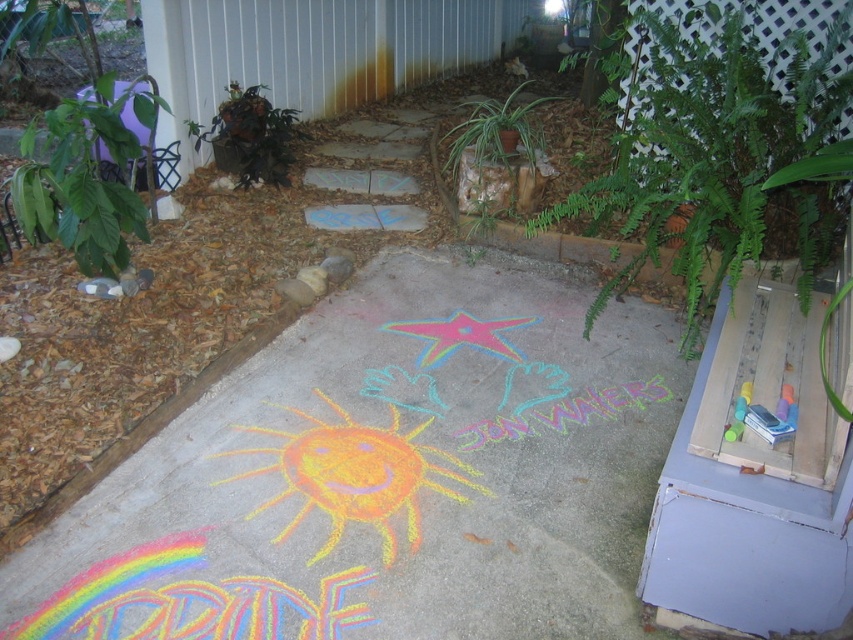
Question: Does chalk drawing at center appear over green leafy plant at upper left?

Choices:
 (A) no
 (B) yes

Answer: (A)

Question: Which object is farther from the camera taking this photo?

Choices:
 (A) green leafy plant at upper left
 (B) green leafy plant at left
 (C) chalk drawing at center
 (D) green leafy plant at center

Answer: (A)

Question: Considering the relative positions of green leafy plant at left and green leafy plant at upper left in the image provided, where is green leafy plant at left located with respect to green leafy plant at upper left?

Choices:
 (A) left
 (B) right

Answer: (A)

Question: Which object is the farthest from the rainbow chalk at lower left?

Choices:
 (A) chalk drawing at center
 (B) green leafy plant at left

Answer: (B)

Question: Which point appears closest to the camera in this image?

Choices:
 (A) (305, 616)
 (B) (151, 170)
 (C) (257, 157)

Answer: (A)

Question: Is chalk drawing at center closer to camera compared to rainbow chalk at lower left?

Choices:
 (A) no
 (B) yes

Answer: (A)